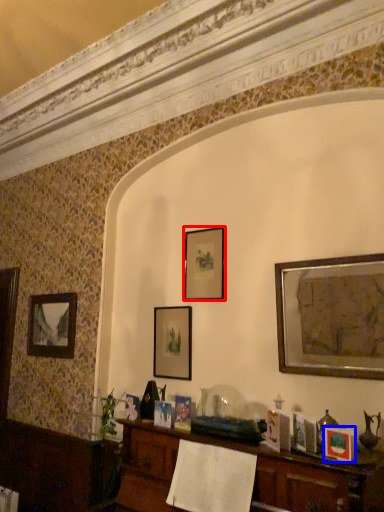
Question: Among these objects, which one is nearest to the camera, picture frame (highlighted by a red box) or picture frame (highlighted by a blue box)?

Choices:
 (A) picture frame
 (B) picture frame

Answer: (B)